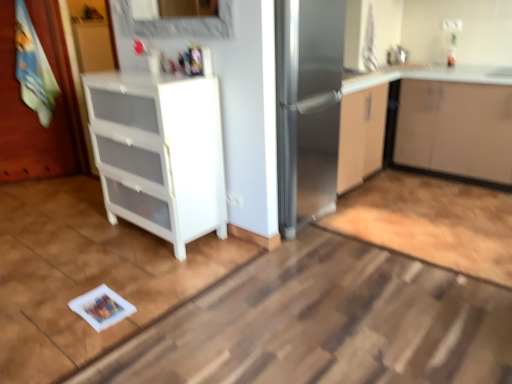
The image size is (512, 384). In order to click on vacant space underneath wooden painted door at left (from a real-world perspective) in this screenshot , I will do [55, 179].